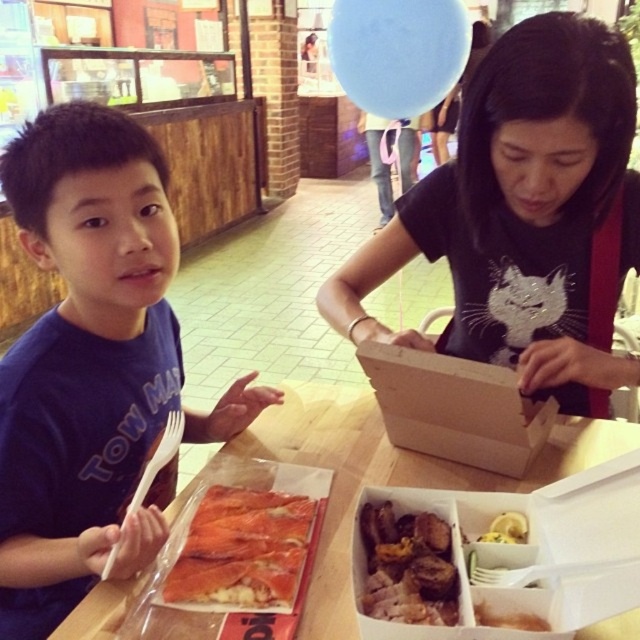
You are a waiter in a food court and need to place a drink order form between the two points labeled point (465, 264) and point (593, 496). Which point should the form be placed closer to so that it is nearer to the customer sitting closer to you?

The form should be placed closer to point (465, 264) because it is closer to the viewer than point (593, 496).

You are a waiter in a food court and need to deliver a drink to the white cardboard box at lower center and the wooden box at center. Which one should you place the drink closer to, based on their positions?

You should place the drink closer to the white cardboard box at lower center because it is in front of the wooden box at center.

You are a customer in the food court and want to place your drink on the table. The table is rectangular. Where should you place it so it doesn not block the white cardboard box at lower center? Please provide coordinates based on the table as a coordinate system with the bottom left corner as origin. The table has a length of 1.2 meters and width of 0.6 meters. The coordinate system uses the bottom left corner as the origin point. The white cardboard box at lower center is located at point (529, 552) in

The white cardboard box at lower center is located at coordinates (529, 552) on the table. To avoid blocking it, place your drink either to the left of this point along the x axis or behind it along the y axis, ensuring there is space between the drink and the box. For example, placing the drink at coordinates 0.7, 0.8 would be to the left, or 0.864, 0.7 would be behind the box.